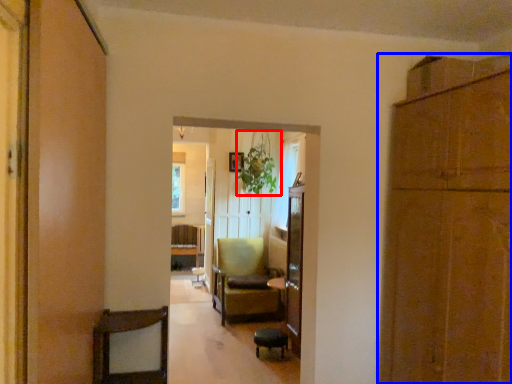
Question: Which point is further to the camera, plant (highlighted by a red box) or cabinetry (highlighted by a blue box)?

Choices:
 (A) plant
 (B) cabinetry

Answer: (A)